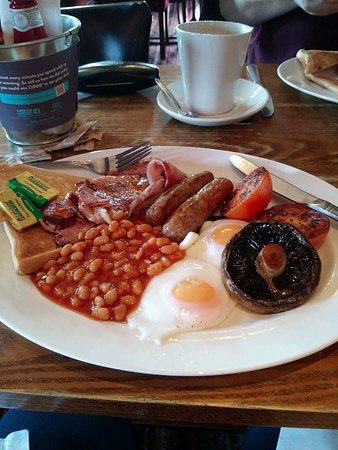
Identify the location of white plate. The width and height of the screenshot is (338, 450). (225, 361).